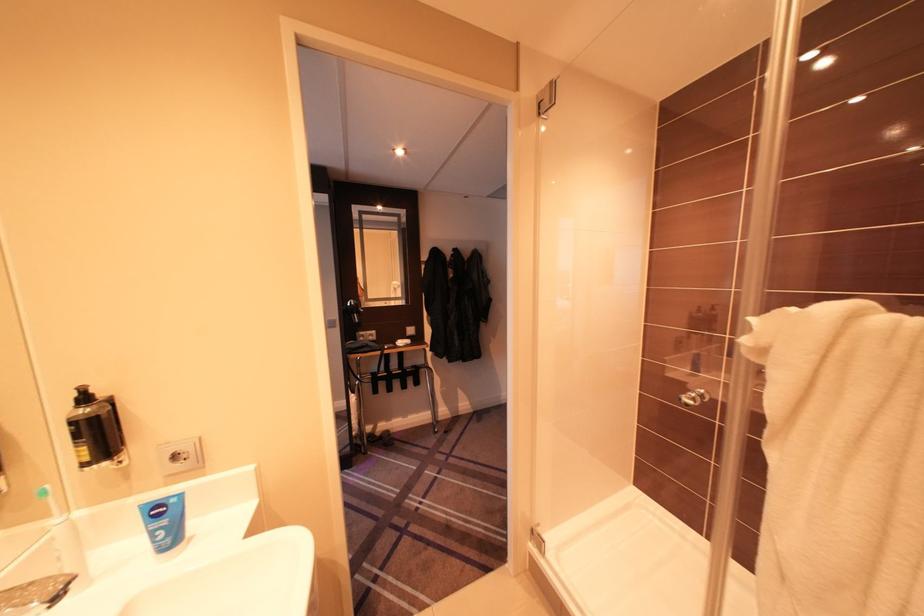
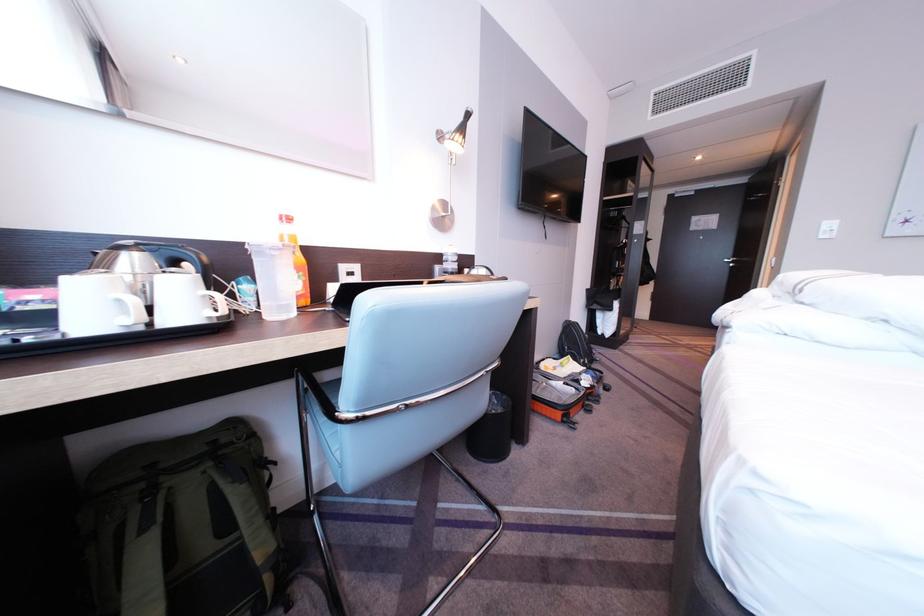
Question: I am providing you with two images of the same scene from different viewpoints. Please identify which objects are invisible in image2.

Choices:
 (A) white plastic lid
 (B) green backpack
 (C) lamp head
 (D) dispenser pump

Answer: (D)